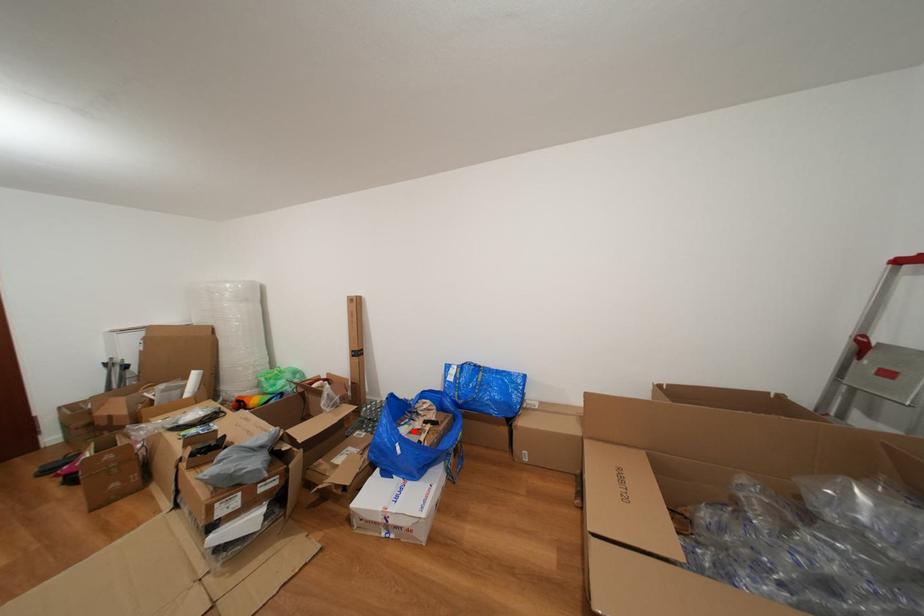
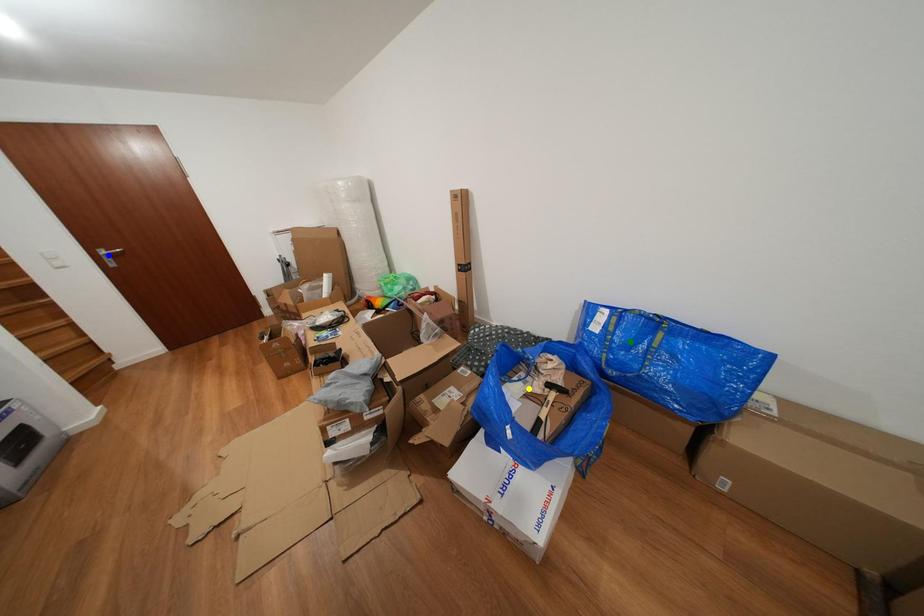
Question: I am providing you with two images of the same scene from different viewpoints. A red point is marked on the first image. You are given multiple points on the second image. Which point in image 2 is actually the same real-world point as the red point in image 1?

Choices:
 (A) yellow point
 (B) blue point
 (C) green point

Answer: (A)